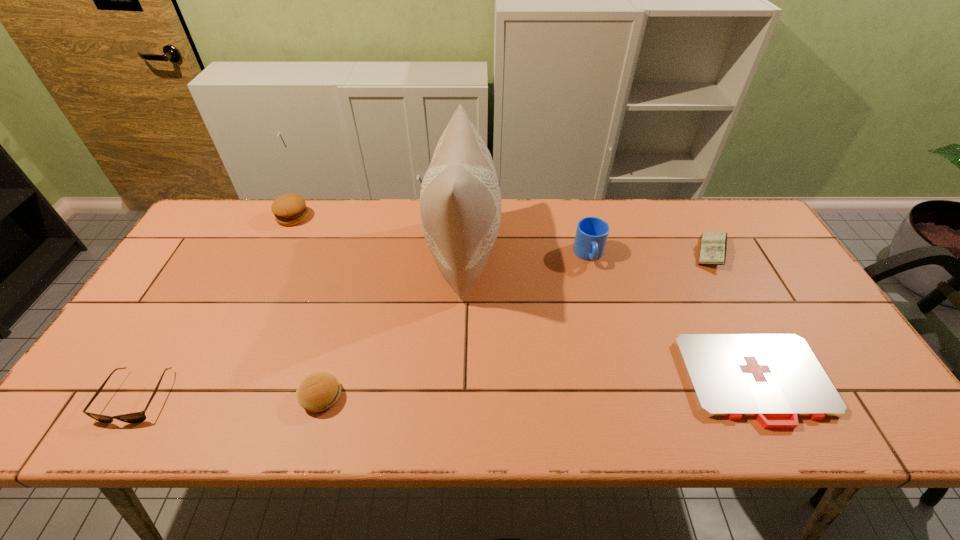
In order to click on the fourth object from right to left in this screenshot , I will do `click(460, 200)`.

The image size is (960, 540). In order to click on cushion in this screenshot , I will do `click(460, 200)`.

Locate an element on the screen. the fifth object from left to right is located at coordinates (591, 235).

Where is `the second tallest object`? The height and width of the screenshot is (540, 960). the second tallest object is located at coordinates (591, 235).

At what (x,y) coordinates should I click in order to perform the action: click on the third tallest object. Please return your answer as a coordinate pair (x, y). Looking at the image, I should click on (289, 209).

Image resolution: width=960 pixels, height=540 pixels. What are the coordinates of `hamburger` in the screenshot? It's located at (289, 209).

The width and height of the screenshot is (960, 540). In order to click on diary in this screenshot , I will do `click(713, 247)`.

In order to click on patty in this screenshot , I will do `click(318, 392)`.

At what (x,y) coordinates should I click in order to perform the action: click on the leftmost object. Please return your answer as a coordinate pair (x, y). Looking at the image, I should click on (137, 417).

Locate an element on the screen. The image size is (960, 540). sunglasses is located at coordinates (137, 417).